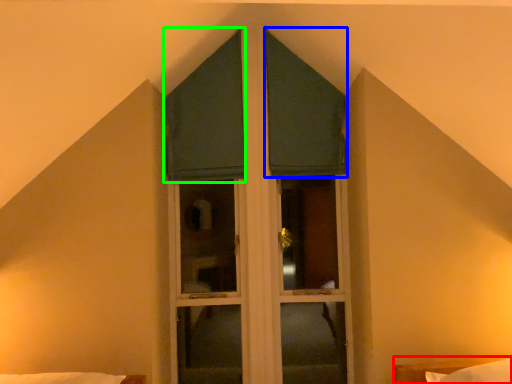
Question: Which object is positioned farthest from bed (highlighted by a red box)? Select from curtain (highlighted by a blue box) and curtain (highlighted by a green box).

Choices:
 (A) curtain
 (B) curtain

Answer: (B)